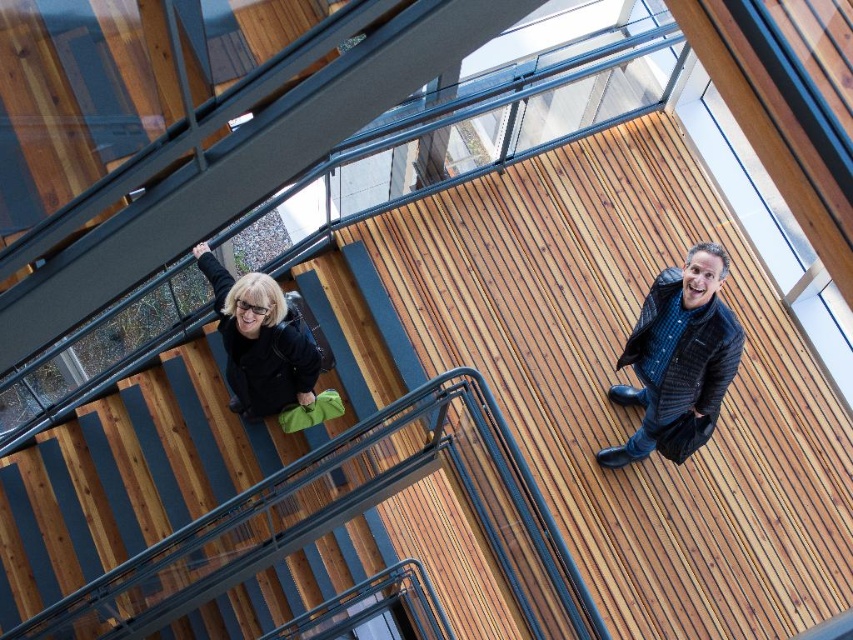
How far apart are dark blue textured jacket at upper right and matte black jacket at center?

dark blue textured jacket at upper right is 4.66 feet from matte black jacket at center.

Can you confirm if dark blue textured jacket at upper right is taller than matte black jacket at center?

Correct, dark blue textured jacket at upper right is much taller as matte black jacket at center.

Is point (641, 403) in front of point (244, 410)?

Yes, point (641, 403) is closer to viewer.

Find the location of `dark blue textured jacket at upper right`. dark blue textured jacket at upper right is located at coordinates (677, 353).